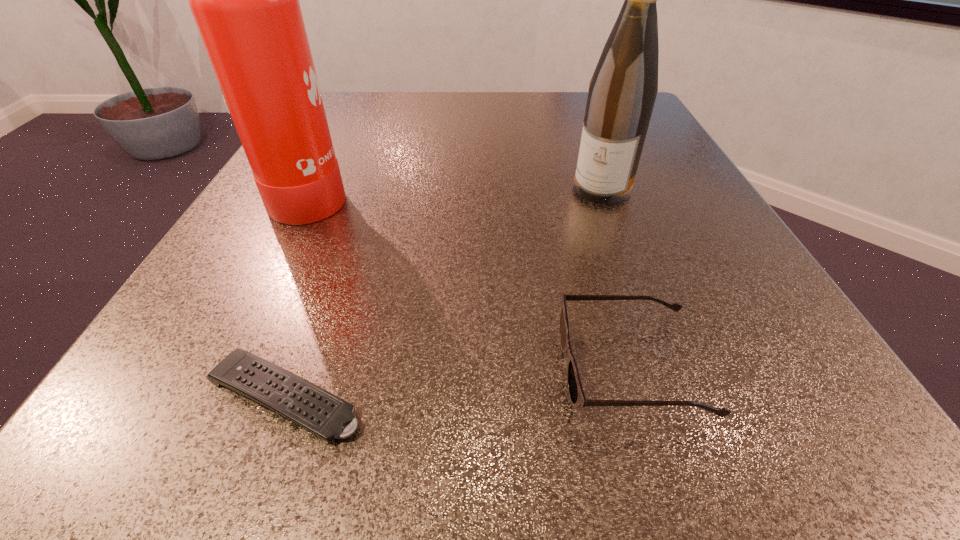
In order to click on sunglasses at the near edge in this screenshot , I will do `click(576, 394)`.

Identify the location of remote control at the near edge. The height and width of the screenshot is (540, 960). (324, 414).

The width and height of the screenshot is (960, 540). In order to click on fire extinguisher situated at the left edge in this screenshot , I will do `click(245, 0)`.

Locate an element on the screen. Image resolution: width=960 pixels, height=540 pixels. remote control located in the left edge section of the desktop is located at coordinates (324, 414).

The height and width of the screenshot is (540, 960). I want to click on wine bottle that is at the right edge, so click(x=622, y=92).

Locate an element on the screen. The height and width of the screenshot is (540, 960). sunglasses positioned at the right edge is located at coordinates (576, 394).

This screenshot has height=540, width=960. Identify the location of object that is at the near left corner. (324, 414).

The width and height of the screenshot is (960, 540). I want to click on object positioned at the near right corner, so click(x=576, y=394).

Where is `blank space at the far edge of the desktop`? The image size is (960, 540). blank space at the far edge of the desktop is located at coordinates (416, 100).

The width and height of the screenshot is (960, 540). In the image, there is a desktop. Identify the location of blank space at the near edge. (563, 410).